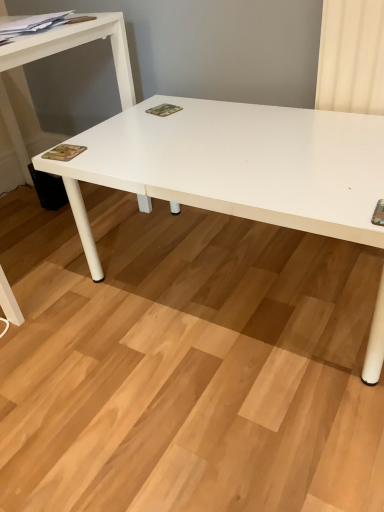
This screenshot has height=512, width=384. What do you see at coordinates (58, 52) in the screenshot? I see `white matte table at left` at bounding box center [58, 52].

Image resolution: width=384 pixels, height=512 pixels. I want to click on white matte table at left, so click(58, 52).

Is camouflage fabric magazine at center, the third magazine when ordered from left to right, oriented away from matte paper magazine at upper left, which is the third magazine from right to left?

No, camouflage fabric magazine at center, the third magazine when ordered from left to right, is not facing away from matte paper magazine at upper left, which is the third magazine from right to left.

From the image's perspective, between camouflage fabric magazine at center, placed as the 1th magazine when sorted from right to left, and matte paper magazine at upper left, the third magazine when ordered from bottom to top, which one is located above?

A: From the image's view, matte paper magazine at upper left, the third magazine when ordered from bottom to top, is above.

Which of these two, matte paper magazine at upper left, the first magazine positioned from the left, or camouflage paper at lower left, placed as the second magazine when sorted from left to right, is bigger?

matte paper magazine at upper left, the first magazine positioned from the left, is bigger.

Is there a large distance between matte paper magazine at upper left, which is the third magazine from right to left, and camouflage paper at lower left, which appears as the 2th magazine when viewed from the right?

No, matte paper magazine at upper left, which is the third magazine from right to left, is not far away from camouflage paper at lower left, which appears as the 2th magazine when viewed from the right.

The image size is (384, 512). I want to click on magazine on the left of camouflage paper at lower left, placed as the second magazine when sorted from left to right, so click(x=31, y=23).

From a real-world perspective, relative to white matte table at left, is matte paper magazine at upper left, the first magazine positioned from the left, vertically above or below?

Clearly, from a real-world perspective, matte paper magazine at upper left, the first magazine positioned from the left, is above white matte table at left.

Which of these two, matte paper magazine at upper left, the first magazine positioned from the left, or white matte table at left, is smaller?

matte paper magazine at upper left, the first magazine positioned from the left.

Find the location of a particular element. Image resolution: width=384 pixels, height=512 pixels. table below the matte paper magazine at upper left, the first magazine positioned from the left (from a real-world perspective) is located at coordinates tap(58, 52).

Between matte paper magazine at upper left, which is the 1th magazine from top to bottom, and white matte table at left, which one has larger width?

With larger width is white matte table at left.

Is point (52, 150) closer or farther from the camera than point (154, 113)?

Point (52, 150) is positioned closer to the camera compared to point (154, 113).

From the picture: Relative to camouflage fabric magazine at center, the third magazine when ordered from left to right, is camouflage paper at lower left, placed as the second magazine when sorted from left to right, in front or behind?

camouflage paper at lower left, placed as the second magazine when sorted from left to right, is positioned closer to the viewer than camouflage fabric magazine at center, the third magazine when ordered from left to right.

From the image's perspective, would you say camouflage paper at lower left, the third magazine when ordered from top to bottom, is shown under camouflage fabric magazine at center, the third magazine when ordered from left to right?

Yes, from the image's perspective, camouflage paper at lower left, the third magazine when ordered from top to bottom, is beneath camouflage fabric magazine at center, the third magazine when ordered from left to right.

From the image's perspective, is camouflage fabric magazine at center, the 2th magazine in the top-to-bottom sequence, positioned above or below white matte table at left?

Based on their image positions, camouflage fabric magazine at center, the 2th magazine in the top-to-bottom sequence, is located above white matte table at left.

Based on the photo, is camouflage fabric magazine at center, the 2th magazine in the top-to-bottom sequence, oriented away from white matte table at left?

No, camouflage fabric magazine at center, the 2th magazine in the top-to-bottom sequence,'s orientation is not away from white matte table at left.

Between camouflage fabric magazine at center, the second magazine when ordered from bottom to top, and white matte table at left, which one appears on the right side from the viewer's perspective?

Positioned to the right is camouflage fabric magazine at center, the second magazine when ordered from bottom to top.

Considering the relative sizes of camouflage fabric magazine at center, the second magazine when ordered from bottom to top, and white matte table at left in the image provided, is camouflage fabric magazine at center, the second magazine when ordered from bottom to top, wider than white matte table at left?

In fact, camouflage fabric magazine at center, the second magazine when ordered from bottom to top, might be narrower than white matte table at left.

From a real-world perspective, is white matte table at left physically located above or below camouflage paper at lower left, the 1th magazine in the bottom-to-top sequence?

Clearly, from a real-world perspective, white matte table at left is below camouflage paper at lower left, the 1th magazine in the bottom-to-top sequence.

Is the depth of white matte table at left greater than that of camouflage paper at lower left, the 1th magazine in the bottom-to-top sequence?

No, the depth of white matte table at left is less than that of camouflage paper at lower left, the 1th magazine in the bottom-to-top sequence.

How many degrees apart are the facing directions of white matte table at left and camouflage paper at lower left, placed as the second magazine when sorted from left to right?

The facing directions of white matte table at left and camouflage paper at lower left, placed as the second magazine when sorted from left to right, are 87.5 degrees apart.

Locate an element on the screen. Image resolution: width=384 pixels, height=512 pixels. magazine that is the 2nd object above the white matte table at left (from a real-world perspective) is located at coordinates (63, 152).

Where is `the 2nd magazine below the matte paper magazine at upper left, which is the 1th magazine from top to bottom (from the image's perspective)`? Image resolution: width=384 pixels, height=512 pixels. the 2nd magazine below the matte paper magazine at upper left, which is the 1th magazine from top to bottom (from the image's perspective) is located at coordinates (63, 152).

Are camouflage paper at lower left, the 1th magazine in the bottom-to-top sequence, and matte paper magazine at upper left, the third magazine when ordered from bottom to top, beside each other?

There is a gap between camouflage paper at lower left, the 1th magazine in the bottom-to-top sequence, and matte paper magazine at upper left, the third magazine when ordered from bottom to top.

Is matte paper magazine at upper left, which is the 1th magazine from top to bottom, inside camouflage paper at lower left, the 1th magazine in the bottom-to-top sequence?

No, matte paper magazine at upper left, which is the 1th magazine from top to bottom, is not surrounded by camouflage paper at lower left, the 1th magazine in the bottom-to-top sequence.

Is point (63, 148) behind point (57, 17)?

No, it is in front of (57, 17).

In order to click on magazine that is the 2nd object located in front of the camouflage fabric magazine at center, the third magazine when ordered from left to right in this screenshot , I will do [31, 23].

Where is `the 1st magazine positioned below the matte paper magazine at upper left, which is the third magazine from right to left (from a real-world perspective)`? the 1st magazine positioned below the matte paper magazine at upper left, which is the third magazine from right to left (from a real-world perspective) is located at coordinates (63, 152).

Which object lies further to the anchor point camouflage paper at lower left, placed as the second magazine when sorted from left to right, matte paper magazine at upper left, which is the 1th magazine from top to bottom, or white matte table at left?

matte paper magazine at upper left, which is the 1th magazine from top to bottom.

Which object lies nearer to the anchor point white matte table at left, matte paper magazine at upper left, which is the 1th magazine from top to bottom, or camouflage paper at lower left, which appears as the 2th magazine when viewed from the right?

Among the two, matte paper magazine at upper left, which is the 1th magazine from top to bottom, is located nearer to white matte table at left.

Considering their positions, is camouflage fabric magazine at center, the third magazine when ordered from left to right, positioned closer to white matte table at left than camouflage paper at lower left, the third magazine when ordered from top to bottom?

Among the two, camouflage fabric magazine at center, the third magazine when ordered from left to right, is located nearer to white matte table at left.

When comparing their distances from camouflage paper at lower left, placed as the second magazine when sorted from left to right, does white matte table at left or matte paper magazine at upper left, which is the 1th magazine from top to bottom, seem closer?

The object closer to camouflage paper at lower left, placed as the second magazine when sorted from left to right, is white matte table at left.

Looking at the image, which one is located closer to matte paper magazine at upper left, the first magazine positioned from the left, white matte table at left or camouflage paper at lower left, the third magazine when ordered from top to bottom?

white matte table at left is closer to matte paper magazine at upper left, the first magazine positioned from the left.

When comparing their distances from white matte table at left, does camouflage paper at lower left, the 1th magazine in the bottom-to-top sequence, or camouflage fabric magazine at center, the 2th magazine in the top-to-bottom sequence, seem further?

camouflage paper at lower left, the 1th magazine in the bottom-to-top sequence, lies further to white matte table at left than the other object.

Which object lies nearer to the anchor point matte paper magazine at upper left, the third magazine when ordered from bottom to top, camouflage paper at lower left, the third magazine when ordered from top to bottom, or camouflage fabric magazine at center, the third magazine when ordered from left to right?

Based on the image, camouflage paper at lower left, the third magazine when ordered from top to bottom, appears to be nearer to matte paper magazine at upper left, the third magazine when ordered from bottom to top.

Considering their positions, is matte paper magazine at upper left, the first magazine positioned from the left, positioned closer to camouflage fabric magazine at center, the 2th magazine in the top-to-bottom sequence, than white matte table at left?

Based on the image, white matte table at left appears to be nearer to camouflage fabric magazine at center, the 2th magazine in the top-to-bottom sequence.

I want to click on magazine between matte paper magazine at upper left, the third magazine when ordered from bottom to top, and camouflage paper at lower left, the 1th magazine in the bottom-to-top sequence, in the up-down direction, so click(x=164, y=110).

This screenshot has height=512, width=384. In order to click on table between matte paper magazine at upper left, the first magazine positioned from the left, and camouflage paper at lower left, placed as the second magazine when sorted from left to right, in the vertical direction in this screenshot , I will do `click(58, 52)`.